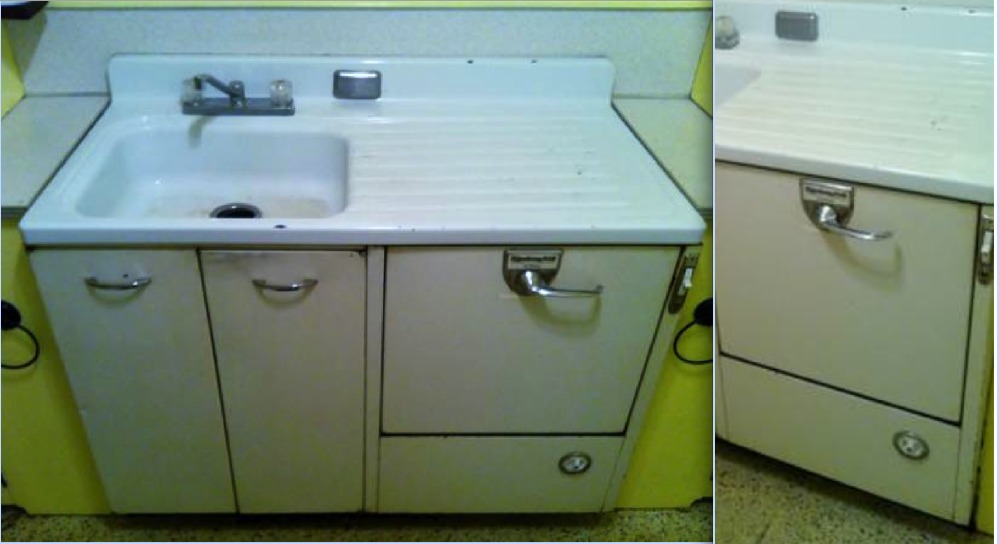
Where is `sink`? This screenshot has height=544, width=999. sink is located at coordinates (209, 173).